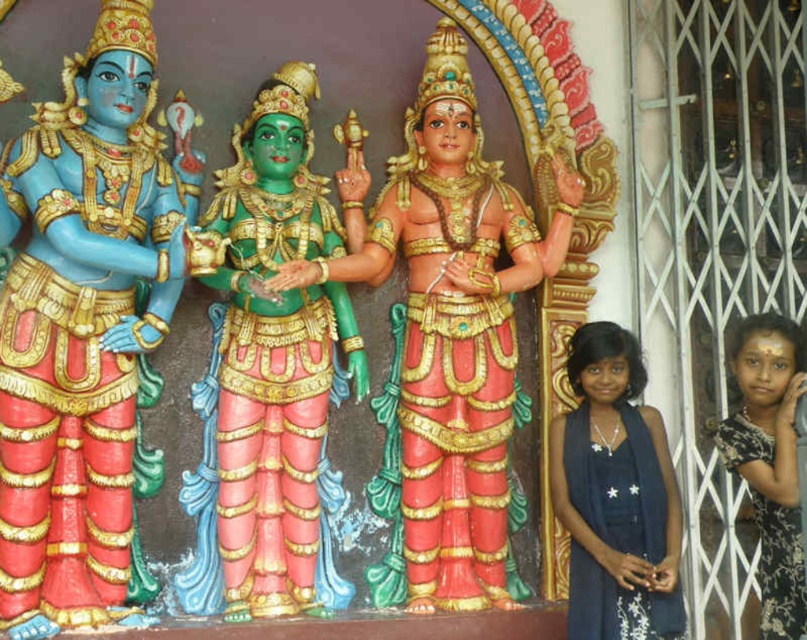
You are standing in front of the three statues and want to touch both point (515, 336) and point (749, 388). Which point should you reach for first?

You should reach for point (515, 336) first because it is closer to you than point (749, 388), which is further away.

You are standing in front of the three statues. You notice two points marked on the image at coordinates point (406,179) and point (567,419). Which point is closer to you?

Point (567,419) is closer to you because it is in front of point (406,179).